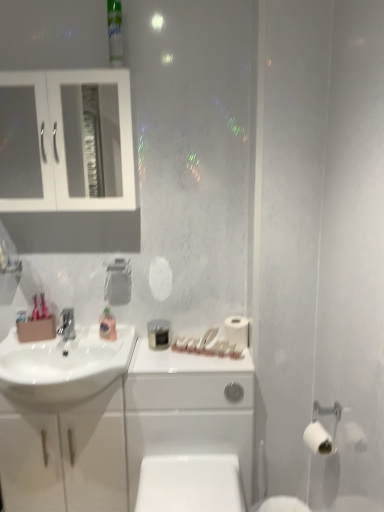
Question: Is white matte toilet paper at right, the 2th toilet paper in the right-to-left sequence, wider or thinner than matte silver faucet at sink left?

Choices:
 (A) wide
 (B) thin

Answer: (B)

Question: From the image's perspective, is white matte toilet paper at right, the second toilet paper from the front, located above or below matte silver faucet at sink left?

Choices:
 (A) above
 (B) below

Answer: (B)

Question: Estimate the real-world distances between objects in this image. Which object is farther from the matte silver faucet at sink left?

Choices:
 (A) white matte toilet paper at right, marked as the 1th toilet paper in a left-to-right arrangement
 (B) white glossy porcelain at center
 (C) white glossy toilet bowl at lower center
 (D) translucent plastic mouthwash at sink, the 1th mouthwash when ordered from left to right
 (E) green plastic mouthwash at upper center, marked as the 1th mouthwash in a front-to-back arrangement

Answer: (E)

Question: Estimate the real-world distances between objects in this image. Which object is closer to the matte silver faucet at sink left?

Choices:
 (A) white glossy toilet bowl at lower center
 (B) green plastic mouthwash at upper center, the second mouthwash in the bottom-to-top sequence
 (C) white matte toilet paper at right, arranged as the 1th toilet paper when viewed from the front
 (D) white glass cabinet at upper left
 (E) translucent plastic mouthwash at sink, acting as the second mouthwash starting from the top

Answer: (E)